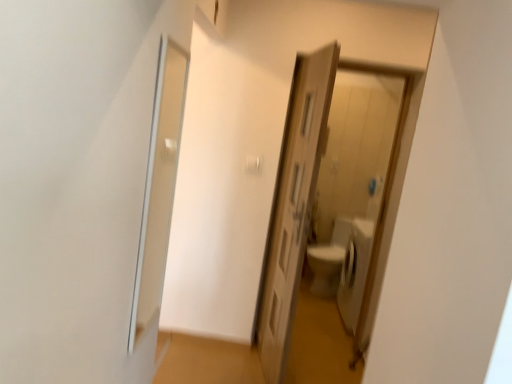
Question: Should I look upward or downward to see white glossy toilet at center, acting as the 1th path starting from the back?

Choices:
 (A) up
 (B) down

Answer: (B)

Question: Is brown wooden door at center, which is the second path from back to front, not within wooden door at center?

Choices:
 (A) yes
 (B) no

Answer: (A)

Question: Does brown wooden door at center, which is the second path from back to front, have a smaller size compared to wooden door at center?

Choices:
 (A) no
 (B) yes

Answer: (B)

Question: Is brown wooden door at center, the first path when ordered from front to back, at the left side of wooden door at center?

Choices:
 (A) yes
 (B) no

Answer: (A)

Question: Is brown wooden door at center, which is the second path from back to front, oriented away from wooden door at center?

Choices:
 (A) yes
 (B) no

Answer: (B)

Question: Considering the relative sizes of brown wooden door at center, the first path when ordered from front to back, and wooden door at center in the image provided, is brown wooden door at center, the first path when ordered from front to back, shorter than wooden door at center?

Choices:
 (A) yes
 (B) no

Answer: (A)

Question: From the image's perspective, does brown wooden door at center, the first path when ordered from front to back, appear lower than wooden door at center?

Choices:
 (A) yes
 (B) no

Answer: (A)

Question: Is brown wooden door at center, which is the second path from back to front, to the right of transparent glass screen door at left from the viewer's perspective?

Choices:
 (A) no
 (B) yes

Answer: (B)

Question: From a real-world perspective, is brown wooden door at center, the first path when ordered from front to back, positioned over transparent glass screen door at left based on gravity?

Choices:
 (A) no
 (B) yes

Answer: (A)

Question: From a real-world perspective, does brown wooden door at center, the first path when ordered from front to back, sit lower than transparent glass screen door at left?

Choices:
 (A) no
 (B) yes

Answer: (B)

Question: Is brown wooden door at center, the first path when ordered from front to back, wider than transparent glass screen door at left?

Choices:
 (A) no
 (B) yes

Answer: (B)

Question: Is brown wooden door at center, which is the second path from back to front, completely or partially outside of transparent glass screen door at left?

Choices:
 (A) no
 (B) yes

Answer: (B)

Question: Is brown wooden door at center, the first path when ordered from front to back, thinner than transparent glass screen door at left?

Choices:
 (A) yes
 (B) no

Answer: (B)

Question: Is wooden door at center shorter than white glossy toilet at center, marked as the second path in a front-to-back arrangement?

Choices:
 (A) no
 (B) yes

Answer: (A)